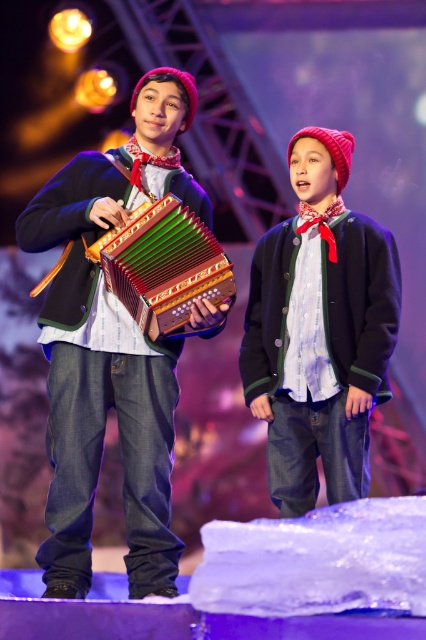
Question: Can you confirm if matte black accordion at center is bigger than wooden textured accordion at center?

Choices:
 (A) no
 (B) yes

Answer: (B)

Question: Is matte black accordion at center thinner than matte black sweater at center?

Choices:
 (A) no
 (B) yes

Answer: (A)

Question: Which point is farther to the camera?

Choices:
 (A) wooden textured accordion at center
 (B) matte black accordion at center
 (C) matte black sweater at center

Answer: (C)

Question: Can you confirm if matte black accordion at center is positioned to the right of wooden textured accordion at center?

Choices:
 (A) no
 (B) yes

Answer: (A)

Question: Among these objects, which one is farthest from the camera?

Choices:
 (A) wooden textured accordion at center
 (B) matte black sweater at center
 (C) matte black accordion at center

Answer: (B)

Question: Which object appears closest to the camera in this image?

Choices:
 (A) matte black sweater at center
 (B) wooden textured accordion at center

Answer: (B)